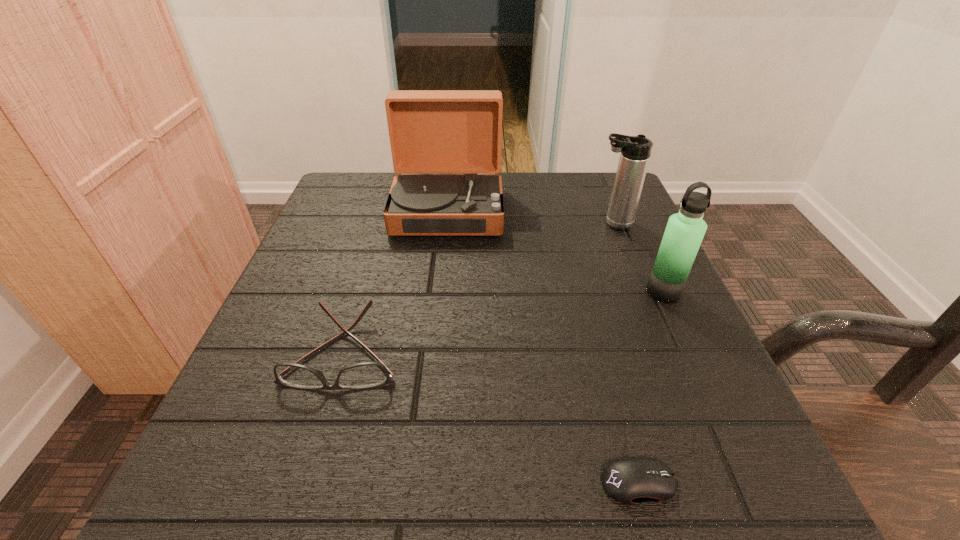
The height and width of the screenshot is (540, 960). What are the coordinates of `vacant point located 0.380m on the handle side of the farther thermos bottle` in the screenshot? It's located at (418, 224).

The height and width of the screenshot is (540, 960). I want to click on vacant space located 0.340m on the handle side of the farther thermos bottle, so click(x=436, y=224).

Where is `free region located on the front-facing side of the spectacles`? free region located on the front-facing side of the spectacles is located at coordinates (310, 468).

Identify the location of vacant space situated on the back of the nearest object. (590, 302).

What are the coordinates of `phonograph record that is at the far edge` in the screenshot? It's located at (431, 131).

Where is `thermos bottle located in the far edge section of the desktop`? The image size is (960, 540). thermos bottle located in the far edge section of the desktop is located at coordinates (635, 151).

Where is `object situated at the near edge`? This screenshot has height=540, width=960. object situated at the near edge is located at coordinates (633, 480).

Where is `phonograph record that is positioned at the left edge`? phonograph record that is positioned at the left edge is located at coordinates (431, 131).

Find the location of `spectacles situated at the left edge`. spectacles situated at the left edge is located at coordinates (363, 375).

I want to click on computer equipment that is positioned at the right edge, so click(633, 480).